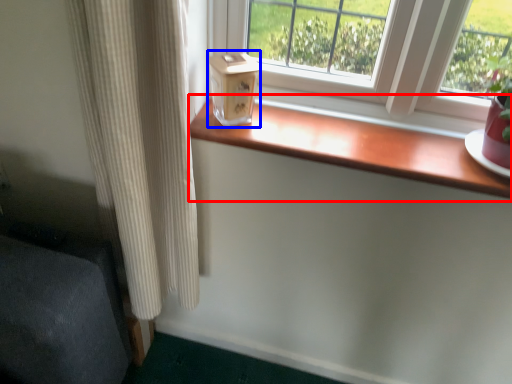
Question: Among these objects, which one is farthest to the camera, window sill (highlighted by a red box) or window box (highlighted by a blue box)?

Choices:
 (A) window sill
 (B) window box

Answer: (B)